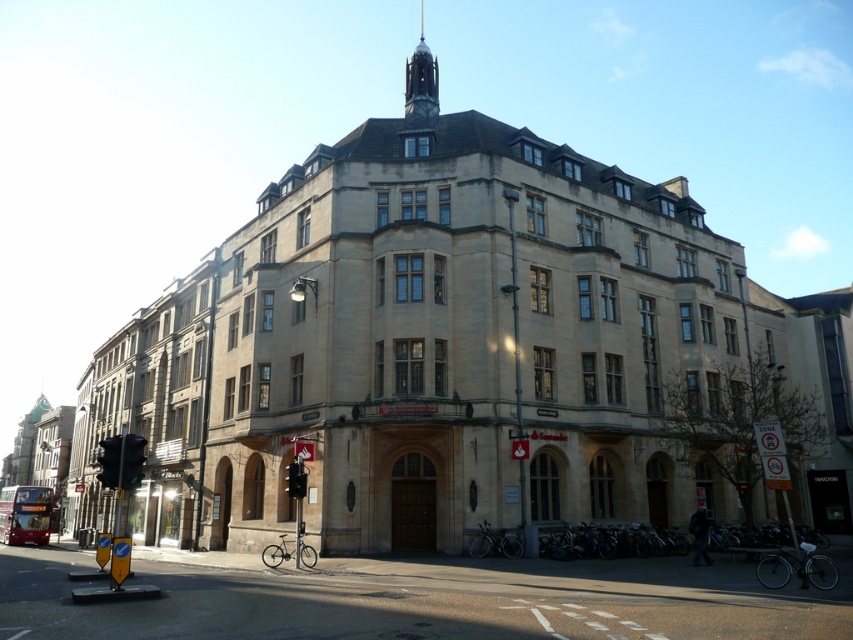
You are standing in front of the multi story building. You see a point at coordinate (113, 484). Is this point closer to you or further away than 120 feet?

The point at coordinate (113, 484) is 119.67 feet from the camera, which is slightly less than 120 feet. Therefore, it is closer than 120 feet.

Based on the photo, you are a pedestrian standing in front of the building and want to cross the street. You notice two traffic lights nearby. The first is the metallic traffic light at lower left, and the second is the metallic rectangular traffic light at center. Which traffic light should you pay attention to for crossing the street safely?

The metallic traffic light at lower left is larger in size compared to the metallic rectangular traffic light at center, so it is more likely to be the one controlling pedestrian crossings. Pay attention to the metallic traffic light at lower left for crossing safely.